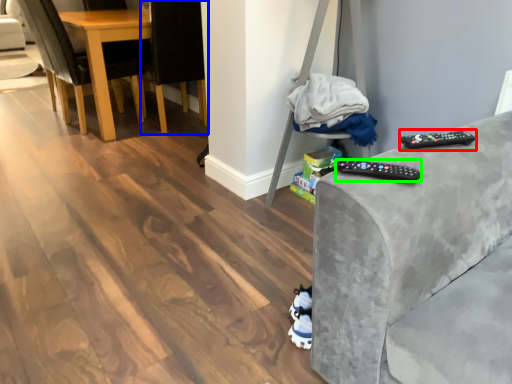
Question: Which object is the closest to the remote (highlighted by a red box)? Choose among these: chair (highlighted by a blue box) or remote (highlighted by a green box).

Choices:
 (A) chair
 (B) remote

Answer: (B)